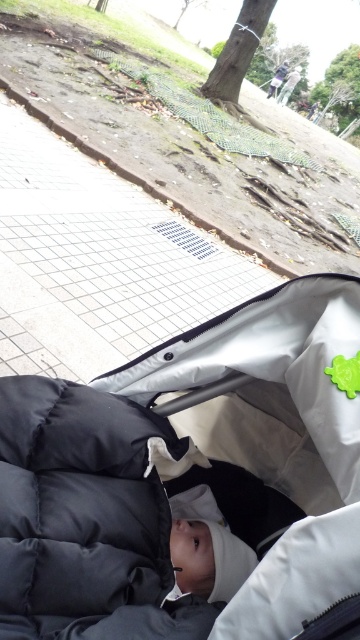
You are sitting in a stroller and want to reach a small green object on the right side of the stroller. The stroller is placed on a paved walkway. If you can stretch your arm 0.9 meters, can you touch the point at coordinates point (168, 580)?

The distance between you and point (168, 580) is 1.01 meters. Since your arm can only stretch 0.9 meters, you cannot reach the point at point 0.907, 0.467.

In the scene shown: You are a parent pushing a stroller through a park. You notice the dark gray quilted fabric baby carriage at center and the white tile pavement at center. Which object is positioned lower in the image?

The dark gray quilted fabric baby carriage at center is positioned lower in the image than the white tile pavement at center.

In the scene shown: You are a parent holding a 1.2 meter tall umbrella. You want to place it between the dark gray quilted fabric baby carriage at center and the black puffy sleeping bag at center. Can the umbrella fit vertically between them?

The dark gray quilted fabric baby carriage at center is much taller than the black puffy sleeping bag at center. The umbrella is 1.2 meters tall, so it can only fit vertically between them if the space between the two objects is at least 1.2 meters. However, since the baby carriage is taller, the vertical space might be sufficient depending on their heights. Without exact measurements of their heights, we cannot definitively confirm if the umbrella will fit.